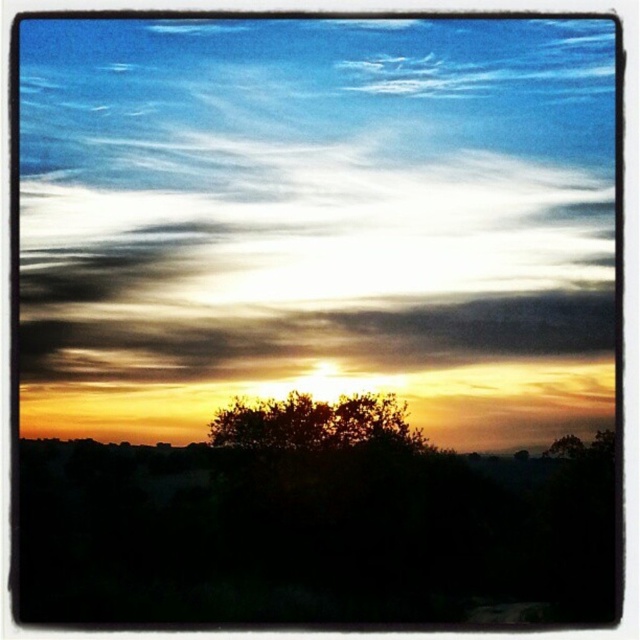
You are an astronomer observing the sunset in the image. You notice the soft white clouds at upper center. What is their exact position in the image?

The soft white clouds at upper center are located at point coordinates of (x=307, y=257).

You are an artist trying to paint the sunset scene. You want to ensure that the soft white clouds at upper center and the dark green leafy tree at center are proportionally accurate. Based on their positions in the image, which object should you paint wider in your artwork?

The soft white clouds at upper center should be painted wider than the dark green leafy tree at center because the description states they might be wider.